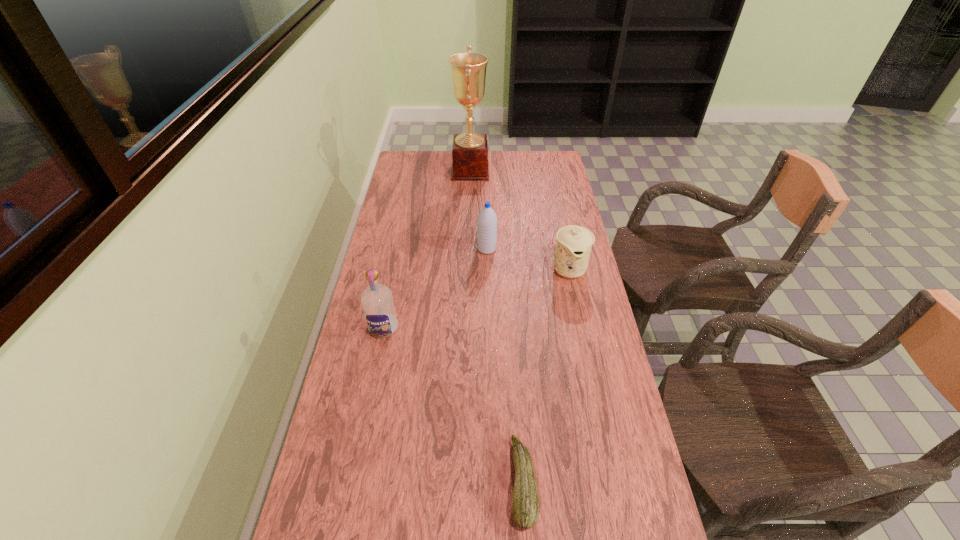
Image resolution: width=960 pixels, height=540 pixels. I want to click on vacant space at the far right corner of the desktop, so click(x=531, y=154).

Image resolution: width=960 pixels, height=540 pixels. What are the coordinates of `unoccupied position between the rightmost object and the second object from right to left` in the screenshot? It's located at (546, 375).

Find the location of a particular element. free spot between the leftmost object and the farthest object is located at coordinates (427, 249).

What are the coordinates of `free spot between the farthest object and the water bottle` in the screenshot? It's located at (479, 210).

Where is `vacant space that's between the trophy cup and the fourth farthest object`? The image size is (960, 540). vacant space that's between the trophy cup and the fourth farthest object is located at coordinates (427, 249).

Find the location of a particular element. The image size is (960, 540). free space between the vodka and the trophy cup is located at coordinates (427, 249).

Identify the location of vacant space in between the shortest object and the water bottle. (505, 366).

Locate an element on the screen. The image size is (960, 540). empty location between the leftmost object and the shortest object is located at coordinates click(453, 405).

Identify which object is the fourth closest to the rightmost object. Please provide its 2D coordinates. Your answer should be formatted as a tuple, i.e. [(x, y)], where the tuple contains the x and y coordinates of a point satisfying the conditions above.

[(525, 501)]

The image size is (960, 540). I want to click on object that can be found as the fourth closest to the fourth farthest object, so 470,150.